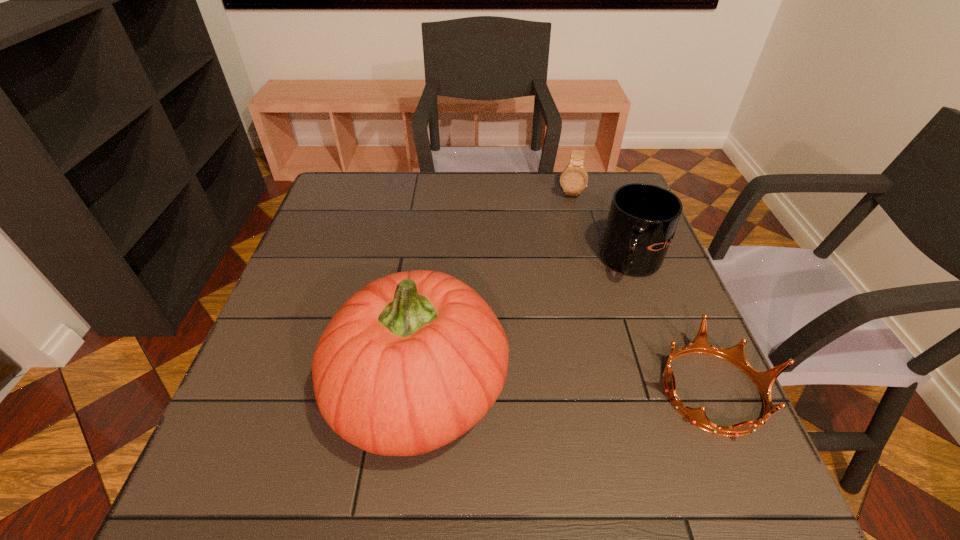
Locate an element on the screen. free space on the desktop that is between the pumpkin and the crown and is positioned with the handle on the side of the mug is located at coordinates (522, 390).

Identify the location of free space on the desktop that is between the leftmost object and the crown and is positioned on the face of the watch. (547, 390).